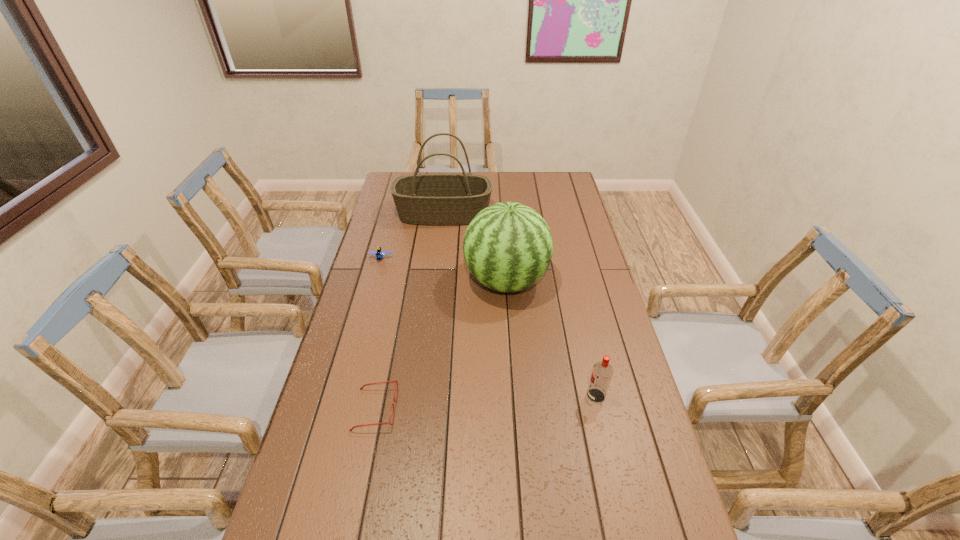
I want to click on watermelon, so click(x=508, y=246).

What are the coordinates of `basket` in the screenshot? It's located at (421, 199).

The image size is (960, 540). I want to click on the third tallest object, so click(602, 372).

What are the coordinates of `vodka` in the screenshot? It's located at (602, 372).

The height and width of the screenshot is (540, 960). What are the coordinates of `Lego` in the screenshot? It's located at (379, 254).

Find the location of `spectacles`. spectacles is located at coordinates (396, 380).

Find the location of a particular element. This screenshot has width=960, height=540. free point located on the back of the watermelon is located at coordinates (503, 231).

Where is `free space located 0.220m on the front of the basket`? This screenshot has width=960, height=540. free space located 0.220m on the front of the basket is located at coordinates (438, 260).

I want to click on vacant point located 0.050m on the front label of the vodka, so click(568, 396).

The height and width of the screenshot is (540, 960). In order to click on free region located 0.370m on the front label of the vodka in this screenshot , I will do `click(454, 396)`.